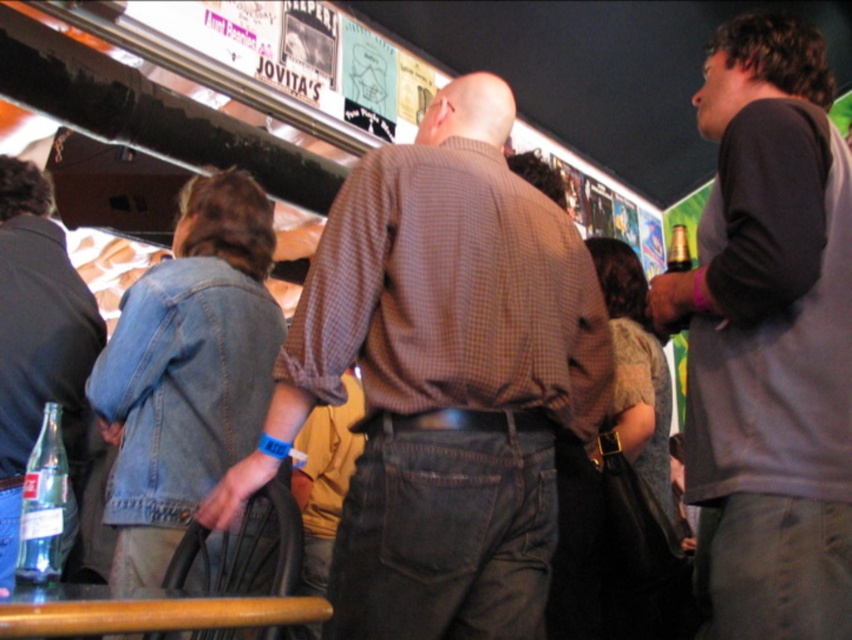
Question: Does brown checkered shirt at center appear on the left side of clear glass bottle at lower left?

Choices:
 (A) yes
 (B) no

Answer: (B)

Question: Among these objects, which one is nearest to the camera?

Choices:
 (A) denim jacket at lower left
 (B) gray sweatshirt at upper right
 (C) clear glass bottle at lower left

Answer: (A)

Question: Which of the following is the farthest from the observer?

Choices:
 (A) (29, 476)
 (B) (712, 227)
 (C) (440, 388)
 (D) (18, 189)

Answer: (D)

Question: Does gray sweatshirt at upper right have a lesser width compared to denim jacket at lower left?

Choices:
 (A) yes
 (B) no

Answer: (A)

Question: Can you confirm if brown checkered shirt at center is positioned below denim jacket at lower left?

Choices:
 (A) yes
 (B) no

Answer: (B)

Question: Which point appears farthest from the camera in this image?

Choices:
 (A) (580, 362)
 (B) (19, 234)
 (C) (763, 320)

Answer: (B)